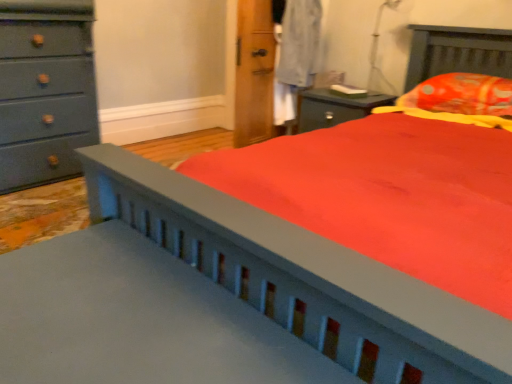
Question: Is point (26, 59) closer or farther from the camera than point (483, 94)?

Choices:
 (A) closer
 (B) farther

Answer: (B)

Question: Is matte gray dresser at left situated inside orange printed fabric pillow at upper right or outside?

Choices:
 (A) inside
 (B) outside

Answer: (B)

Question: Which object is positioned closest to the matte gray dresser at left?

Choices:
 (A) transparent plastic table lamp at upper right
 (B) orange printed fabric pillow at upper right

Answer: (A)

Question: Based on their relative distances, which object is farther from the matte gray dresser at left?

Choices:
 (A) transparent plastic table lamp at upper right
 (B) orange printed fabric pillow at upper right

Answer: (B)